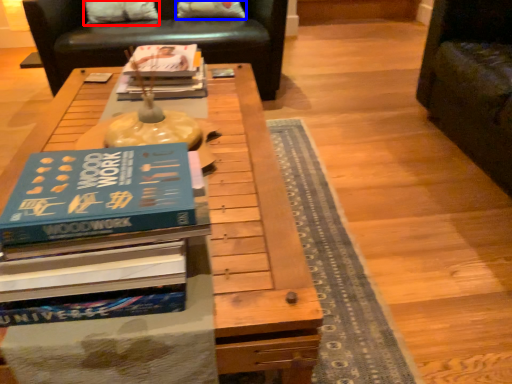
Question: Among these objects, which one is farthest to the camera, pillow (highlighted by a red box) or pillow (highlighted by a blue box)?

Choices:
 (A) pillow
 (B) pillow

Answer: (B)